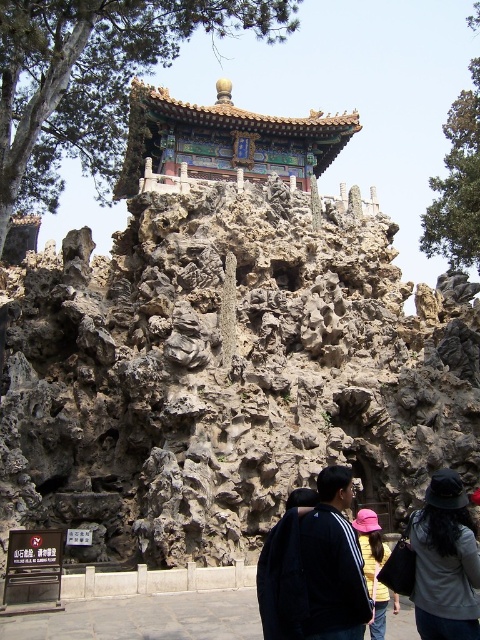
Looking at this image, you are standing in front of a traditional Chinese building with a colorful roof on a rocky base. You notice an object labeled as the black matte jacket at lower center. Where exactly is this jacket located in the scene?

The black matte jacket at lower center is located at the 2D coordinates point (284, 572) in the scene.

You are an architect examining the traditional Chinese structure. You notice the brown rough rock face at center and the pink fabric hat at center. Which object occupies a larger area in the scene?

The brown rough rock face at center is bigger than the pink fabric hat at center, so the brown rough rock face at center occupies a larger area in the scene.